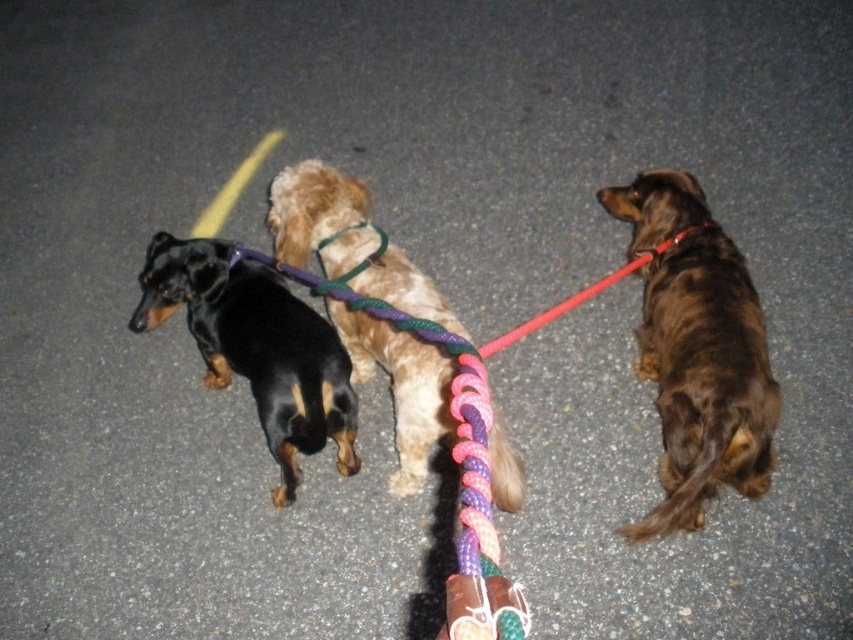
Question: Which object appears farthest from the camera in this image?

Choices:
 (A) black smooth dog at left
 (B) brown furry dog at right
 (C) fuzzy brown dog at center

Answer: (A)

Question: Is brown furry dog at right closer to the viewer compared to black smooth dog at left?

Choices:
 (A) yes
 (B) no

Answer: (A)

Question: Which of the following is the closest to the observer?

Choices:
 (A) (300, 225)
 (B) (711, 461)
 (C) (184, 266)

Answer: (B)

Question: Which of the following is the closest to the observer?

Choices:
 (A) black smooth dog at left
 (B) brown furry dog at right
 (C) fuzzy brown dog at center

Answer: (B)

Question: Can you confirm if brown furry dog at right is smaller than black smooth dog at left?

Choices:
 (A) no
 (B) yes

Answer: (B)

Question: Does brown furry dog at right appear under fuzzy brown dog at center?

Choices:
 (A) yes
 (B) no

Answer: (B)